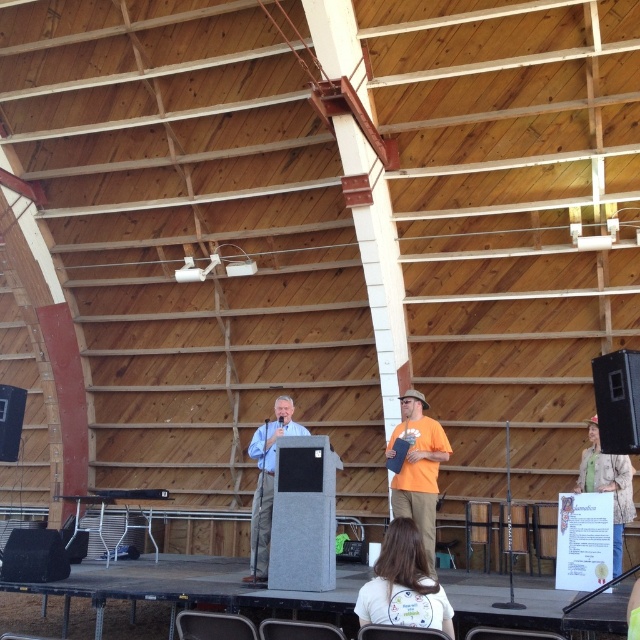
You are attending a presentation and want to take a photo of both the orange cotton shirt at center and the green textured sweater at lower right. Which one should you focus on first to ensure both are in the frame?

You should focus on the orange cotton shirt at center first because it is closer to you than the green textured sweater at lower right, ensuring both are in the frame.

You are standing in the room and want to move from point A to point B. Point A is at coordinate point (449, 452) and point B is at coordinate point (256, 557). Which point is closer to you when you first enter the room?

Point A at coordinate point (449, 452) is closer to the viewer than point B at coordinate point (256, 557), so point A is closer when you first enter the room.

You are standing in the room and want to reach a point that is exactly 30 feet away from you. Is the point at coordinates point (400, 403) within your desired distance range?

The point at coordinates point (400, 403) is 29.59 feet away from you, which is within the desired distance of 30 feet. Yes, it is within range.